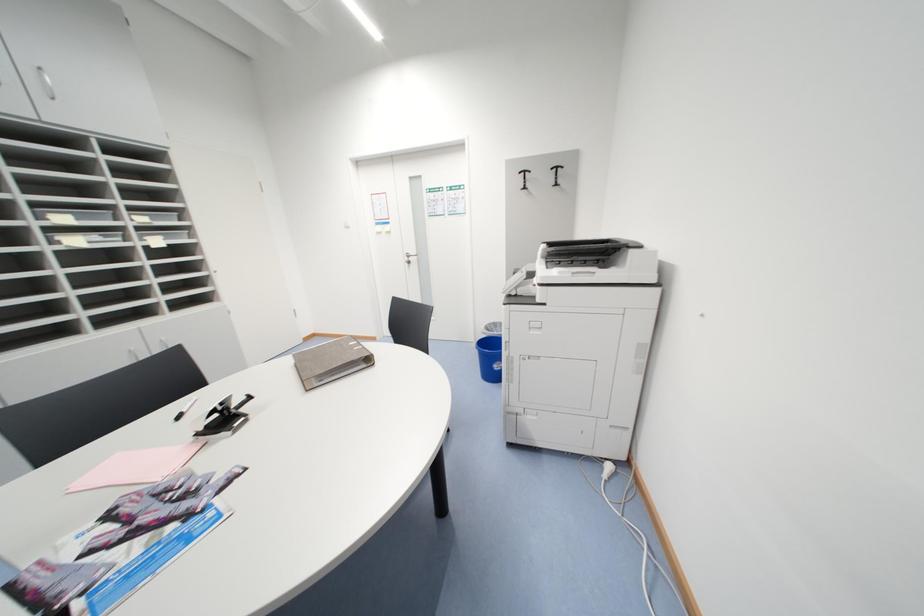
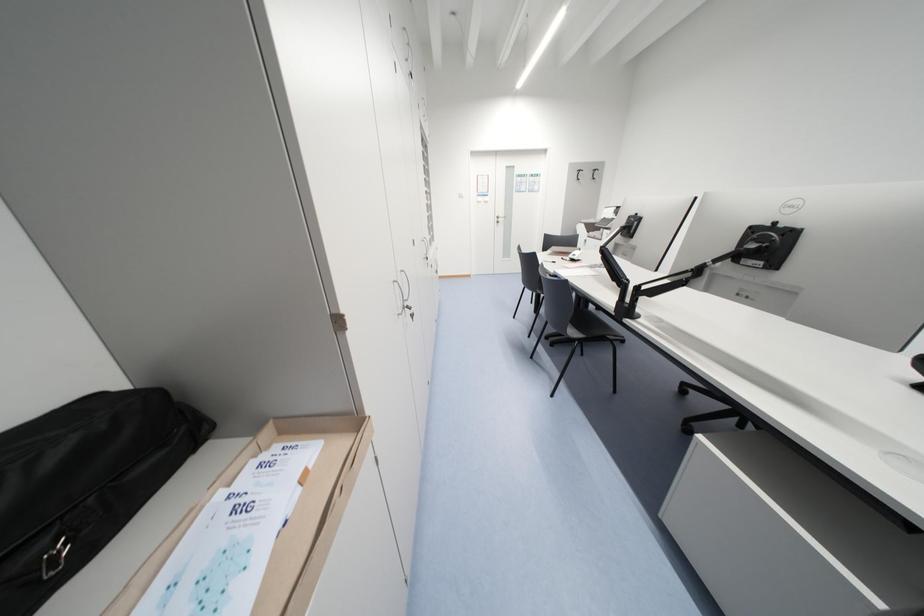
What movement of the cameraman would produce the second image?

The cameraman moved toward left, backward.